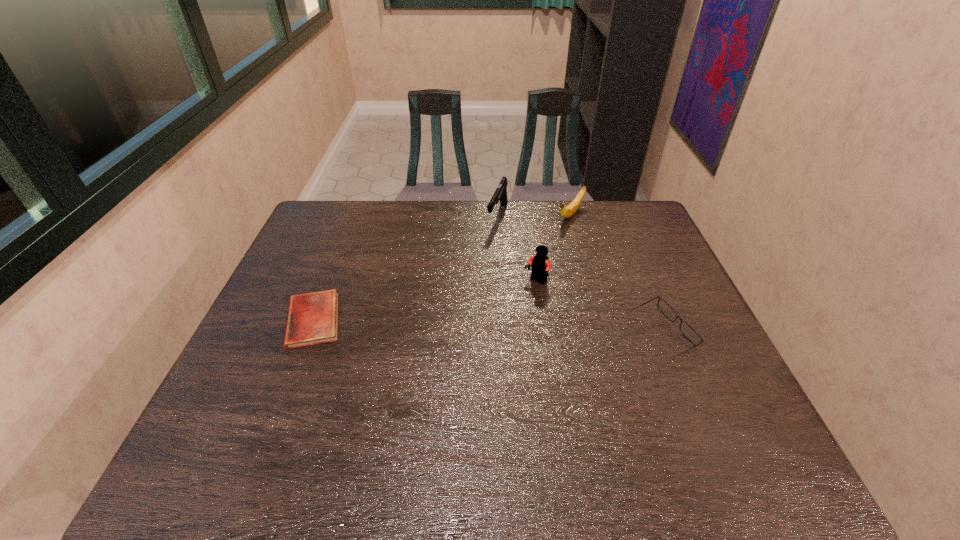
You are a GUI agent. You are given a task and a screenshot of the screen. Output one action in this format:
    pyautogui.click(x=<x>, y=<y>)
    Task: Click on the shortest object
    
    Given the screenshot: What is the action you would take?
    pyautogui.click(x=312, y=318)

Identify the location of diary. Image resolution: width=960 pixels, height=540 pixels. (312, 318).

This screenshot has height=540, width=960. I want to click on spectacles, so click(x=664, y=307).

Locate an element on the screen. The image size is (960, 540). the second shortest object is located at coordinates (664, 307).

This screenshot has height=540, width=960. Find the location of `the third object from right to left`. the third object from right to left is located at coordinates [540, 265].

Where is `Lego`? Image resolution: width=960 pixels, height=540 pixels. Lego is located at coordinates (540, 265).

Locate an element on the screen. Image resolution: width=960 pixels, height=540 pixels. the second object from left to right is located at coordinates (500, 193).

You are a GUI agent. You are given a task and a screenshot of the screen. Output one action in this format:
    pyautogui.click(x=<x>, y=<y>)
    Task: Click on the fourth object from left to right
    The height and width of the screenshot is (540, 960).
    Given the screenshot: What is the action you would take?
    pyautogui.click(x=566, y=212)

The image size is (960, 540). What are the coordinates of `the third tallest object` in the screenshot? It's located at (566, 212).

This screenshot has width=960, height=540. In order to click on vacant space located on the back of the leftmost object in this screenshot , I will do `click(344, 242)`.